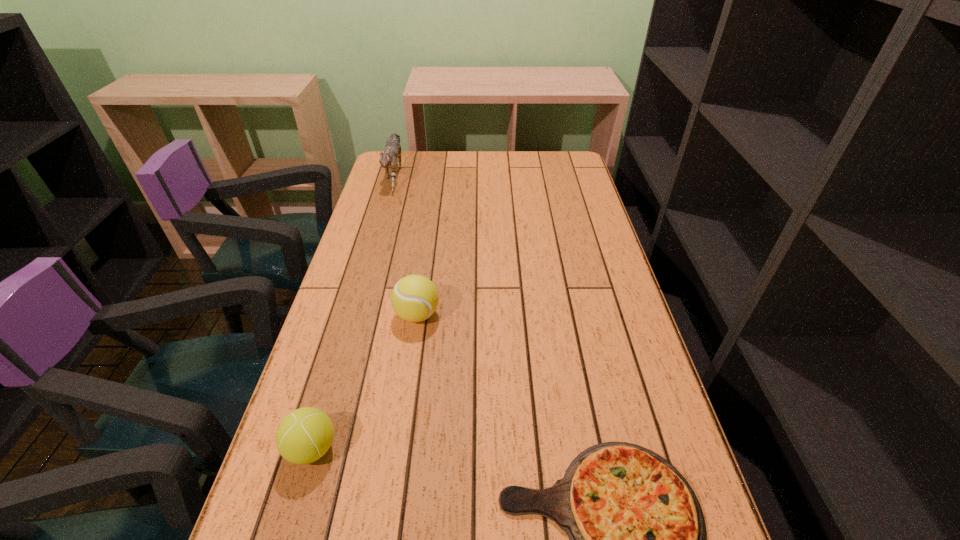
Locate an element on the screen. cat that is at the left edge is located at coordinates (392, 150).

This screenshot has width=960, height=540. What are the coordinates of `tennis ball that is at the left edge` in the screenshot? It's located at (306, 434).

The width and height of the screenshot is (960, 540). In order to click on object situated at the far left corner in this screenshot , I will do coord(392,150).

In order to click on free point at the far edge in this screenshot , I will do `click(460, 178)`.

What are the coordinates of `vacant space at the left edge of the desktop` in the screenshot? It's located at (312, 370).

Where is `vacant space at the right edge`? Image resolution: width=960 pixels, height=540 pixels. vacant space at the right edge is located at coordinates (627, 332).

The image size is (960, 540). Identify the location of free space at the far left corner of the desktop. (420, 158).

The height and width of the screenshot is (540, 960). In order to click on vacant area at the far right corner of the desktop in this screenshot , I will do `click(574, 151)`.

Locate an element on the screen. vacant space in between the third tallest object and the farthest object is located at coordinates (353, 310).

The width and height of the screenshot is (960, 540). I want to click on vacant area that lies between the left tennis ball and the cat, so click(x=353, y=310).